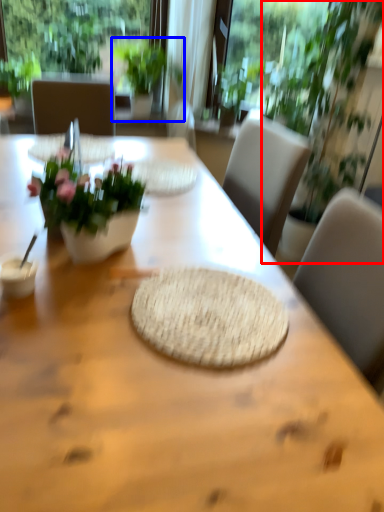
Question: Among these objects, which one is farthest to the camera, houseplant (highlighted by a red box) or houseplant (highlighted by a blue box)?

Choices:
 (A) houseplant
 (B) houseplant

Answer: (B)